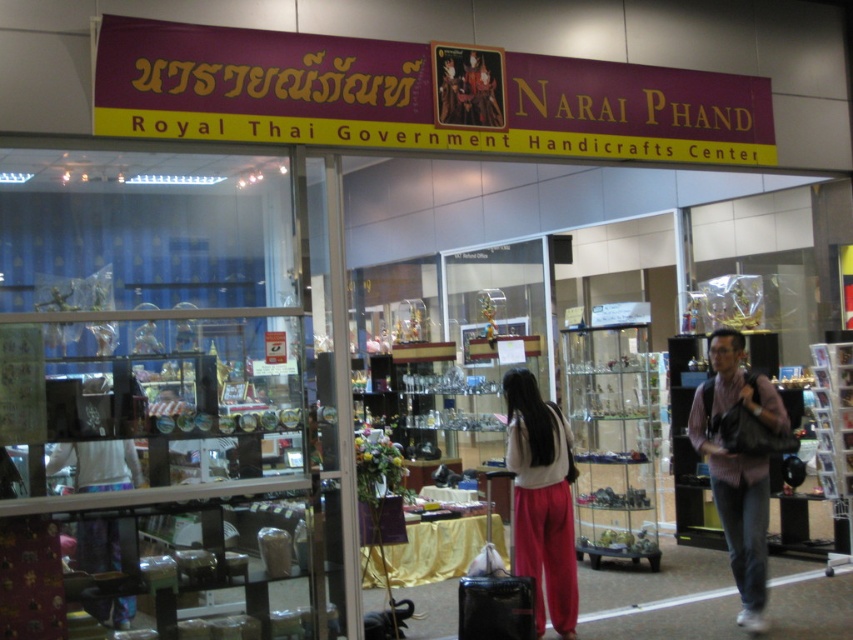
Question: Among these objects, which one is farthest from the camera?

Choices:
 (A) pink striped shirt at center
 (B) white fabric pants at center

Answer: (A)

Question: Is transparent glass display case at left to the left of pink striped shirt at center from the viewer's perspective?

Choices:
 (A) yes
 (B) no

Answer: (A)

Question: Can you confirm if pink striped shirt at center is wider than white fabric pants at center?

Choices:
 (A) yes
 (B) no

Answer: (A)

Question: Can you confirm if transparent glass display case at left is thinner than white fabric pants at center?

Choices:
 (A) no
 (B) yes

Answer: (A)

Question: Which point is farther to the camera?

Choices:
 (A) white fabric pants at center
 (B) pink striped shirt at center
 (C) transparent glass display case at left

Answer: (B)

Question: Which object is closer to the camera taking this photo?

Choices:
 (A) white fabric pants at center
 (B) pink striped shirt at center
 (C) transparent glass display case at left

Answer: (C)